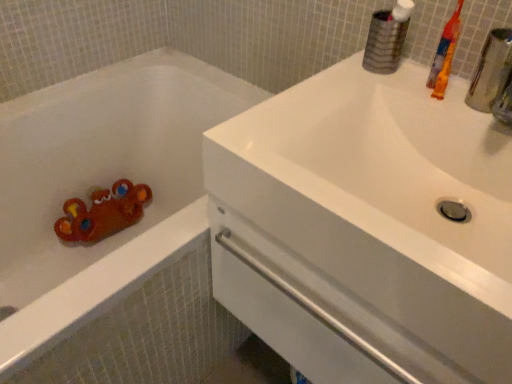
Question: From the image's perspective, is white glossy sink at upper right under matte plastic bathtub at left?

Choices:
 (A) yes
 (B) no

Answer: (B)

Question: From the image's perspective, is white glossy sink at upper right on matte plastic bathtub at left?

Choices:
 (A) yes
 (B) no

Answer: (A)

Question: Would you consider white glossy sink at upper right to be distant from matte plastic bathtub at left?

Choices:
 (A) yes
 (B) no

Answer: (B)

Question: From a real-world perspective, is white glossy sink at upper right located beneath matte plastic bathtub at left?

Choices:
 (A) no
 (B) yes

Answer: (A)

Question: Is white glossy sink at upper right to the left of matte plastic bathtub at left from the viewer's perspective?

Choices:
 (A) yes
 (B) no

Answer: (B)

Question: Is white glossy sink at upper right in front of matte plastic bathtub at left?

Choices:
 (A) yes
 (B) no

Answer: (A)

Question: Is orange plastic toothbrush at upper right bigger than matte plastic bathtub at left?

Choices:
 (A) no
 (B) yes

Answer: (A)

Question: Is orange plastic toothbrush at upper right taller than matte plastic bathtub at left?

Choices:
 (A) no
 (B) yes

Answer: (A)

Question: Does orange plastic toothbrush at upper right come behind matte plastic bathtub at left?

Choices:
 (A) yes
 (B) no

Answer: (A)

Question: Is orange plastic toothbrush at upper right shorter than matte plastic bathtub at left?

Choices:
 (A) no
 (B) yes

Answer: (B)

Question: Does orange plastic toothbrush at upper right appear on the left side of matte plastic bathtub at left?

Choices:
 (A) yes
 (B) no

Answer: (B)

Question: Could you tell me if orange plastic toothbrush at upper right is facing matte plastic bathtub at left?

Choices:
 (A) yes
 (B) no

Answer: (B)

Question: Is matte plastic bathtub at left at the left side of white glossy sink at upper right?

Choices:
 (A) yes
 (B) no

Answer: (A)